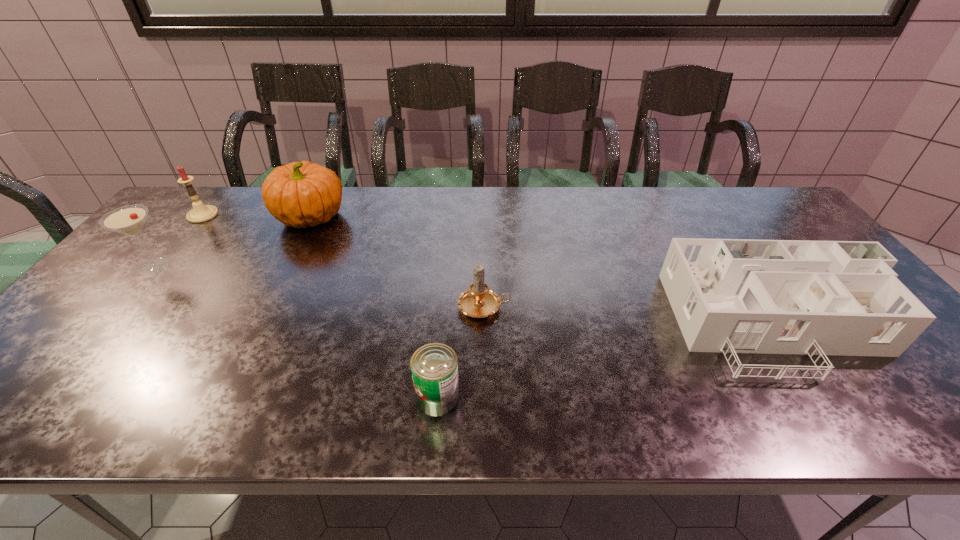
Locate an element on the screen. This screenshot has height=540, width=960. the fourth object from right to left is located at coordinates tap(300, 194).

This screenshot has height=540, width=960. What are the coordinates of `martini` in the screenshot? It's located at (128, 220).

Identify the location of the left candle. The width and height of the screenshot is (960, 540). (200, 213).

This screenshot has height=540, width=960. I want to click on the taller candle, so click(x=200, y=213).

Find the location of a particular element. the right candle is located at coordinates (478, 301).

At what (x,y) coordinates should I click in order to perform the action: click on the nearer candle. Please return your answer as a coordinate pair (x, y). The width and height of the screenshot is (960, 540). Looking at the image, I should click on (478, 301).

Where is `the rightmost object`? The image size is (960, 540). the rightmost object is located at coordinates (842, 298).

You are a GUI agent. You are given a task and a screenshot of the screen. Output one action in this format:
    pyautogui.click(x=<x>, y=<y>)
    Task: Click on the can
    This screenshot has height=540, width=960.
    Given the screenshot: What is the action you would take?
    pyautogui.click(x=434, y=366)

Where is `free space located on the surface of the third object from left to right`? The height and width of the screenshot is (540, 960). free space located on the surface of the third object from left to right is located at coordinates (453, 217).

Where is `vacant point located on the front of the martini`? The width and height of the screenshot is (960, 540). vacant point located on the front of the martini is located at coordinates (132, 294).